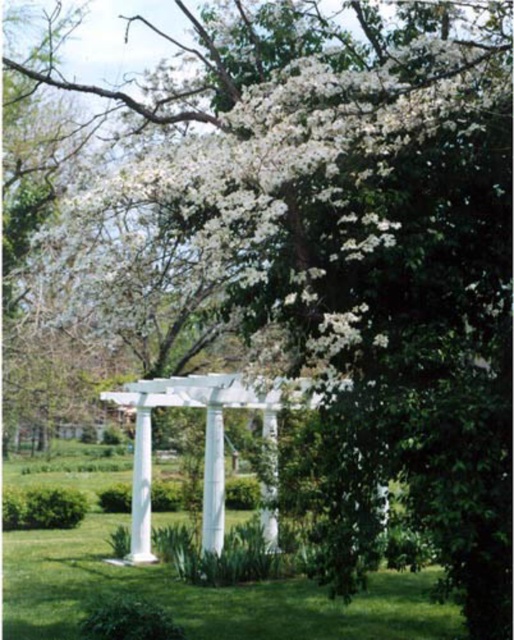
You are standing in the garden and want to place a small garden ornament between the green grass at lower center and the white glossy pillar at center. Based on their positions, which object should you place the ornament closer to if you want it to be on the left side of the pillar?

The green grass at lower center is to the left of the white glossy pillar at center, so placing the ornament closer to the green grass at lower center would position it on the left side of the pillar.

You are a gardener who wants to install a new flower bed between the white painted wood pergola at center and the white smooth pillar at center. The flower bed requires a minimum of 12 inches of space. Based on the scene, will there be enough space?

The white painted wood pergola at center is 10.08 inches from the white smooth pillar at center, which is less than the required 12 inches for the flower bed. Therefore, there is insufficient space to install the flower bed between them.